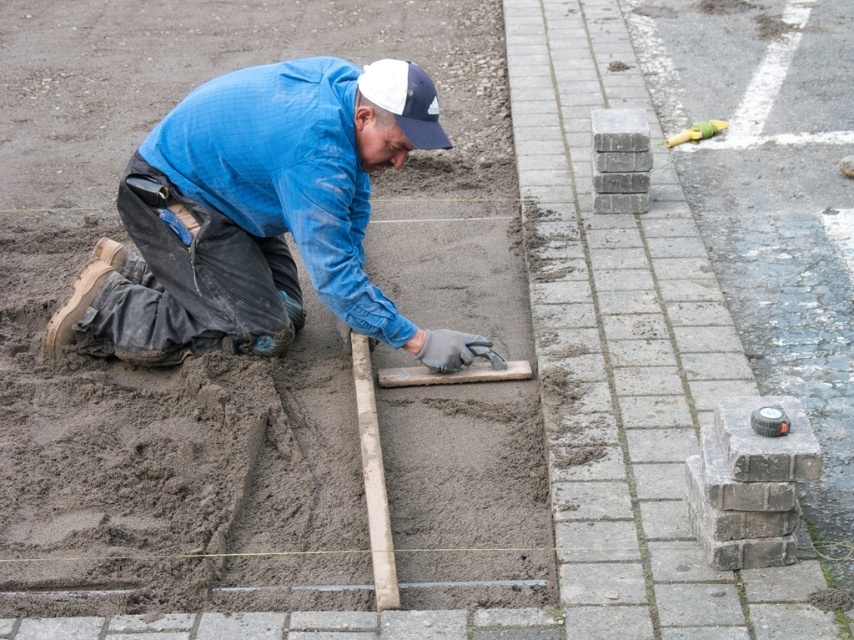
Who is shorter, blue denim jacket at center or white fabric baseball cap at upper center?

white fabric baseball cap at upper center

Is point (387, 163) farther from camera compared to point (420, 106)?

Yes, it is.

Is point (127, 196) positioned after point (408, 113)?

Yes, point (127, 196) is behind point (408, 113).

Find the location of a particular element. Image resolution: width=854 pixels, height=640 pixels. blue denim jacket at center is located at coordinates point(259,218).

This screenshot has height=640, width=854. I want to click on gray concrete bricks at center-right, so click(626, 356).

Looking at this image, how far apart are gray concrete bricks at center-right and blue denim jacket at center?

gray concrete bricks at center-right and blue denim jacket at center are 4.76 feet apart from each other.

Is point (768, 586) positioned after point (98, 288)?

That is False.

Where is `gray concrete bricks at center-right`? This screenshot has width=854, height=640. gray concrete bricks at center-right is located at coordinates (626, 356).

You are a GUI agent. You are given a task and a screenshot of the screen. Output one action in this format:
    pyautogui.click(x=<x>, y=<y>)
    Task: Click on the gray concrete bricks at center-right
    This screenshot has height=640, width=854.
    Given the screenshot: What is the action you would take?
    pyautogui.click(x=626, y=356)

Which of these two, gray concrete bricks at center-right or white fabric baseball cap at upper center, stands taller?

gray concrete bricks at center-right

You are a GUI agent. You are given a task and a screenshot of the screen. Output one action in this format:
    pyautogui.click(x=<x>, y=<y>)
    Task: Click on the gray concrete bricks at center-right
    This screenshot has width=854, height=640.
    Given the screenshot: What is the action you would take?
    click(626, 356)

Locate an element on the screen. The image size is (854, 640). gray concrete bricks at center-right is located at coordinates (626, 356).